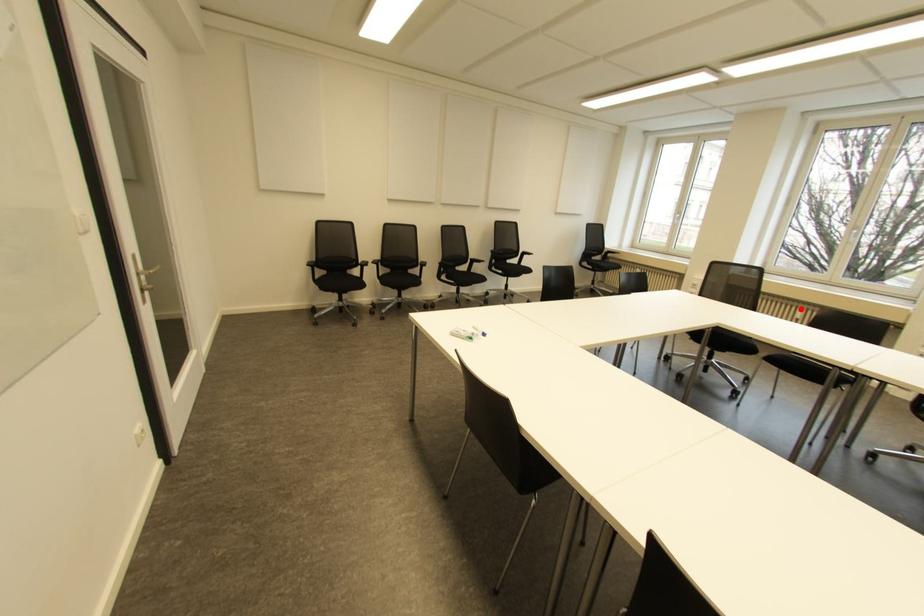
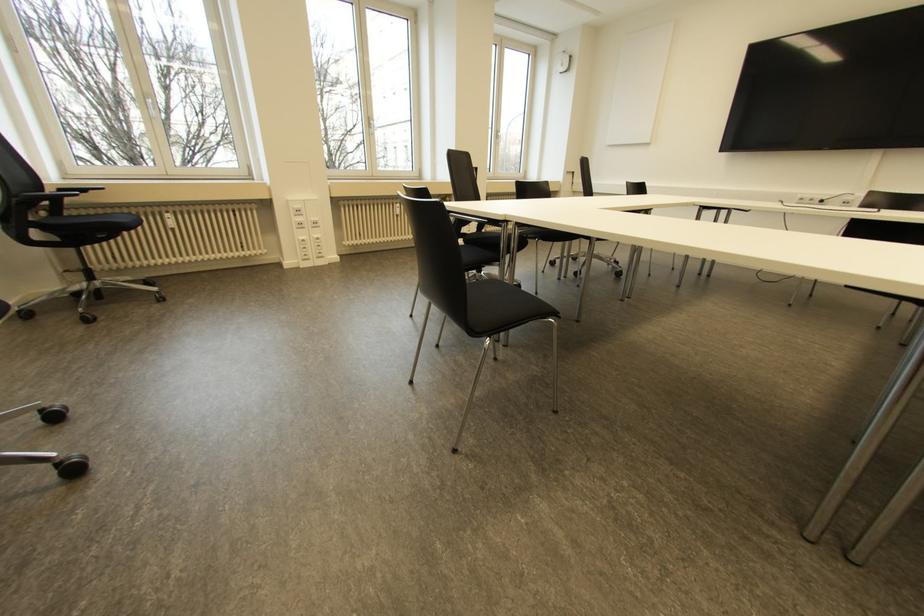
Where in the second image is the point corresponding to the highlighted location from the first image?

(397, 204)